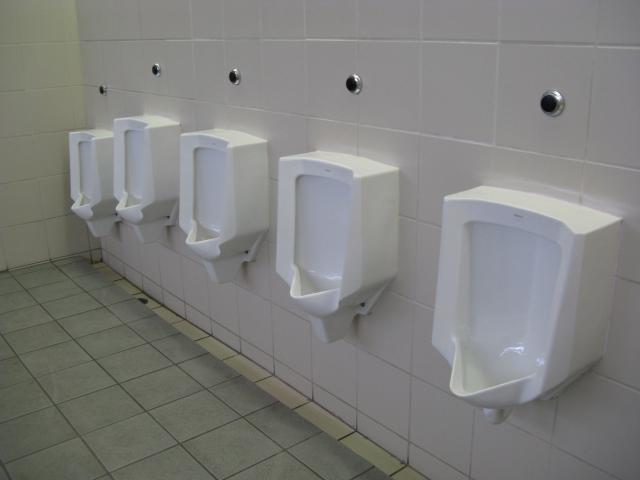
Locate an element on the screen. urinals is located at coordinates (93, 179), (143, 160), (223, 173), (338, 221), (514, 262).